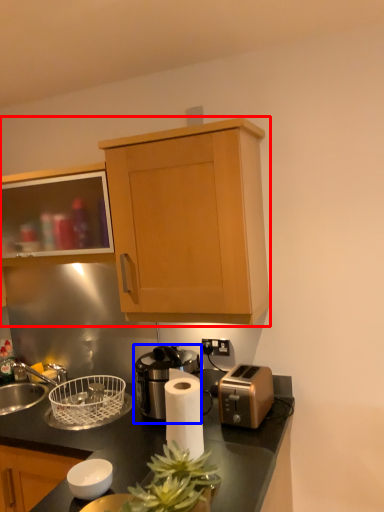
Question: Which of the following is the farthest to the observer, cabinetry (highlighted by a red box) or coffee machine (highlighted by a blue box)?

Choices:
 (A) cabinetry
 (B) coffee machine

Answer: (B)